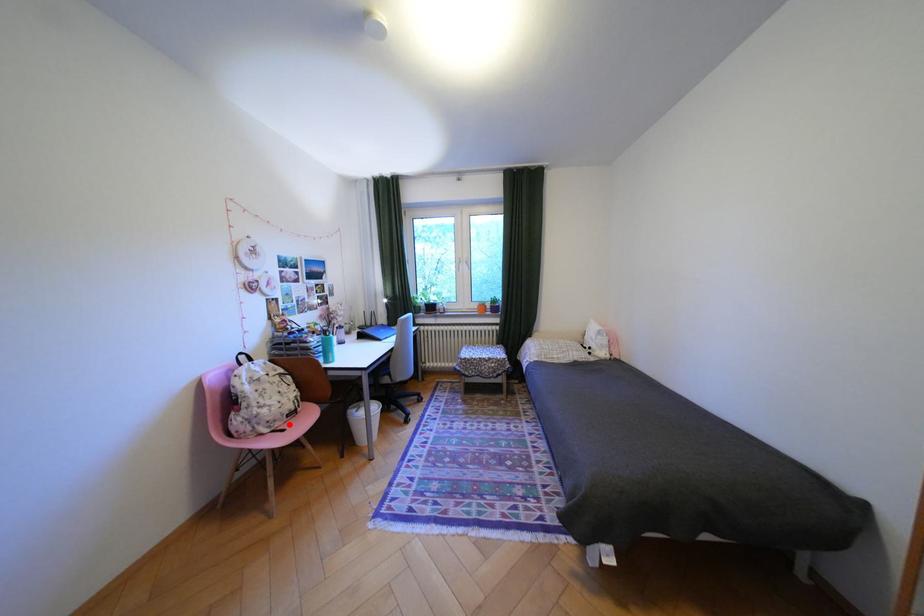
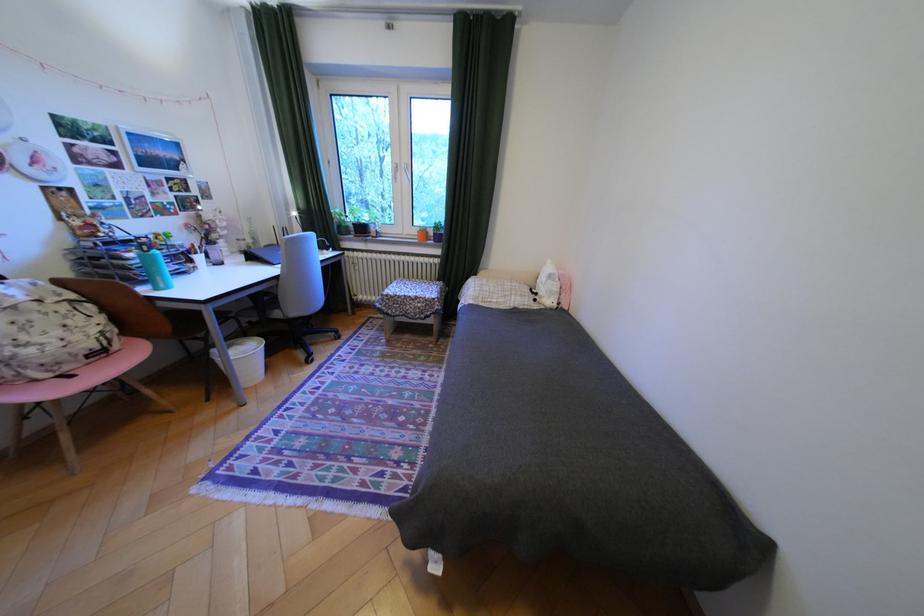
The point at the highlighted location is marked in the first image. Where is the corresponding point in the second image?

(79, 368)